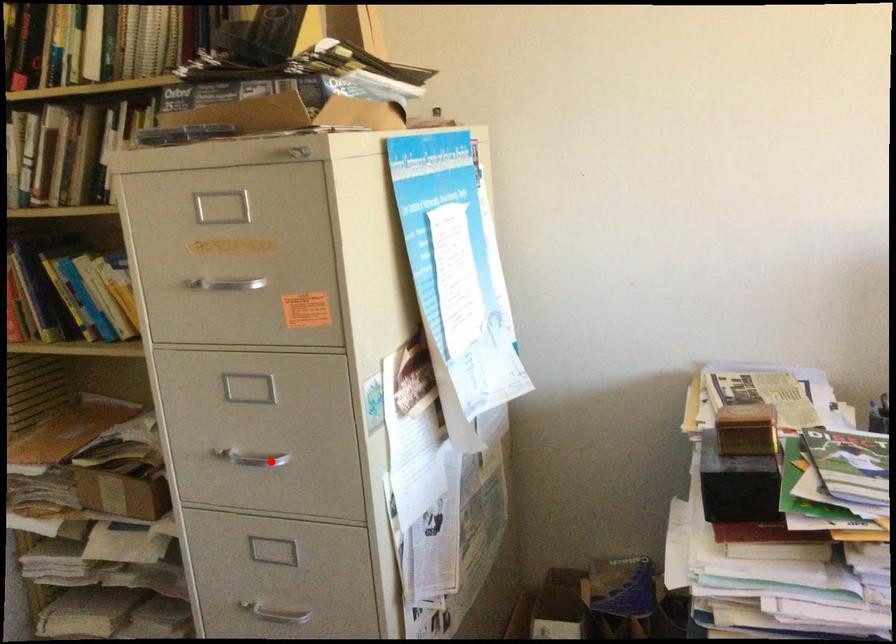
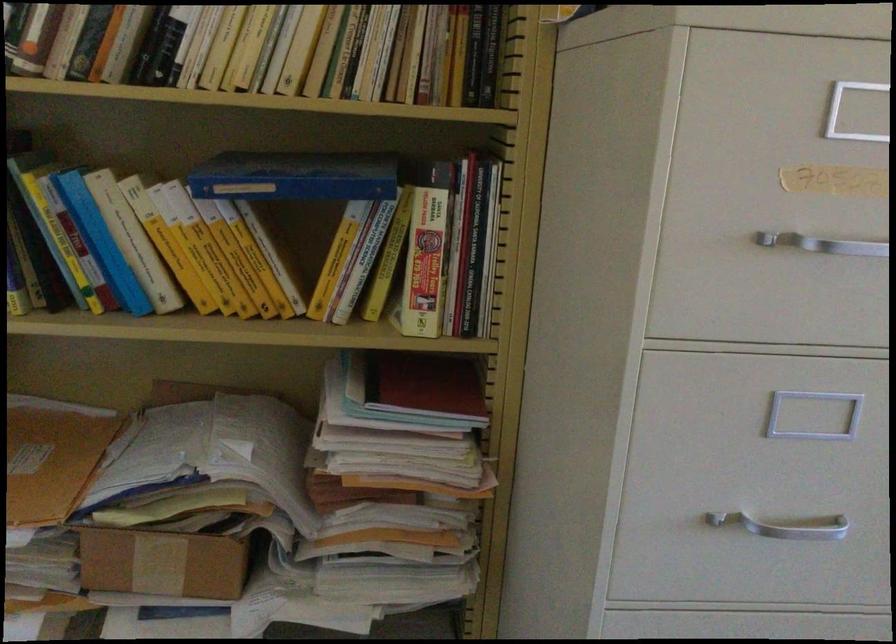
Question: I am providing you with two images of the same scene from different viewpoints. Given a red point in image1, look at the same physical point in image2. Is it:

Choices:
 (A) Closer to the viewpoint
 (B) Farther from the viewpoint

Answer: (A)